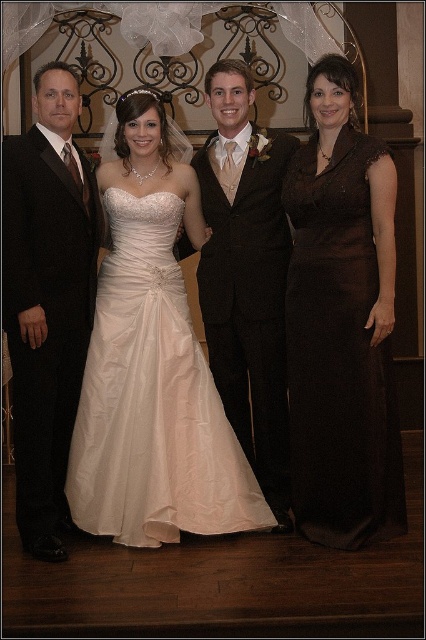
You are a photographer adjusting your camera focus. You need to focus on both point [23,506] and point [199,173] in the image. Which point should you focus on first to ensure the closest object is sharp?

Point [23,506] is closer to the camera than point [199,173], so you should focus on point [23,506] first to ensure the closest object is sharp.

In the wedding scene, there are two individuals dressed in a brown satin dress at right and a satin black suit at center. Based on their positions, which one is standing closer to the ground?

The brown satin dress at right is below the satin black suit at center, so the person wearing the brown satin dress at right is standing closer to the ground.

You are a photographer positioned at the back of the venue. You need to capture a closeup shot of the black satin suit at left and the satin black suit at center. Which one will appear larger in your photo?

The black satin suit at left will appear larger in the photo because it is closer to the viewer than the satin black suit at center.